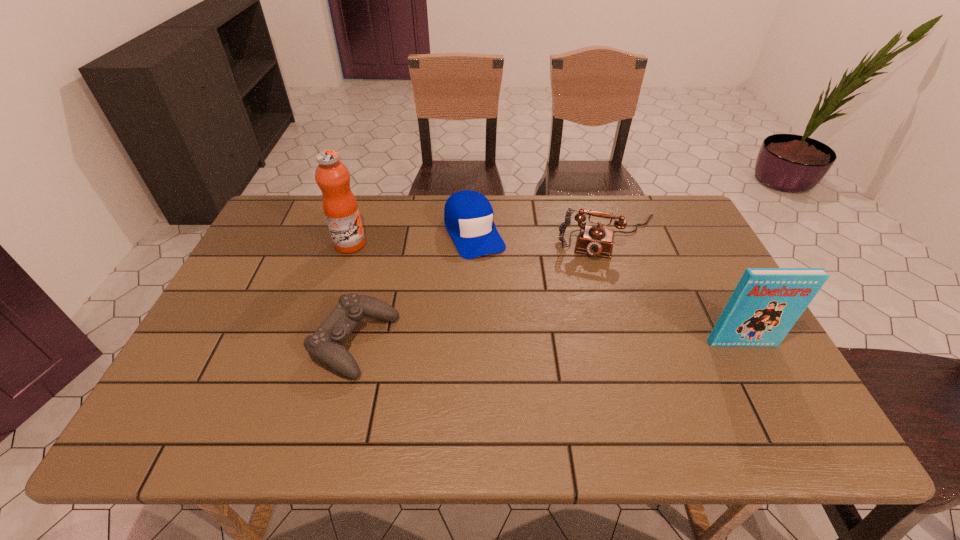
Locate an element on the screen. vacant space that satisfies the following two spatial constraints: 1. on the back side of the fourth tallest object; 2. on the right side of the tallest object is located at coordinates tap(354, 232).